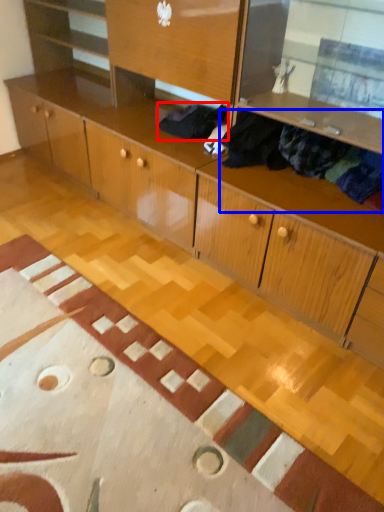
Question: Which point is closer to the camera, clothing (highlighted by a red box) or clothing (highlighted by a blue box)?

Choices:
 (A) clothing
 (B) clothing

Answer: (B)